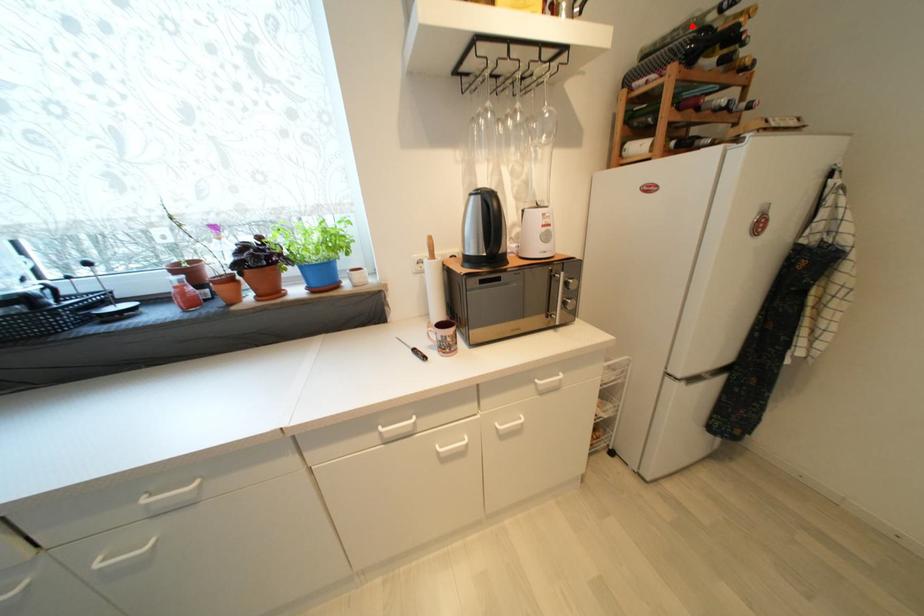
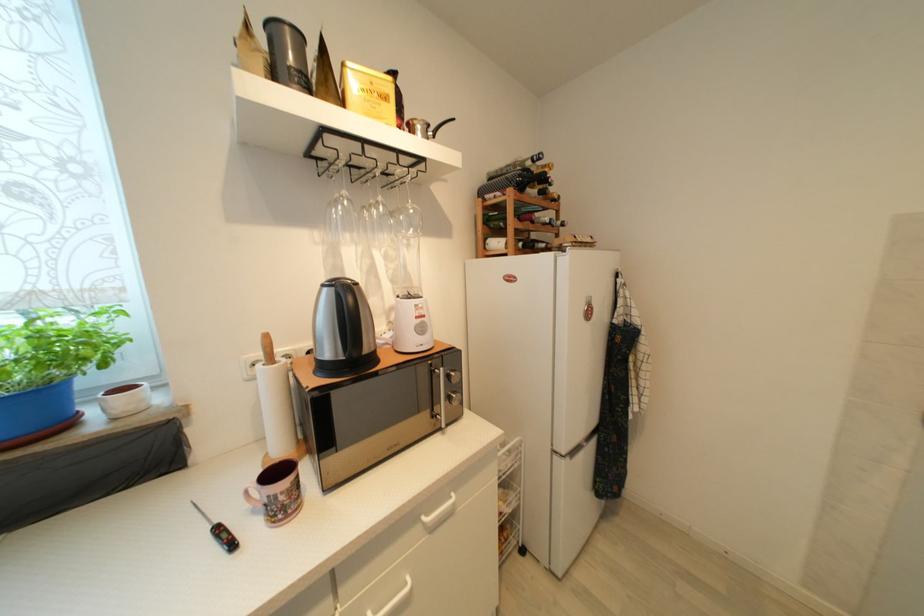
Question: I am providing you with two images of the same scene from different viewpoints. Image1 has a red point marked. In image2, the corresponding 3D location appears at what relative position? Reply with the corresponding letter.

Choices:
 (A) Closer
 (B) Farther

Answer: (A)